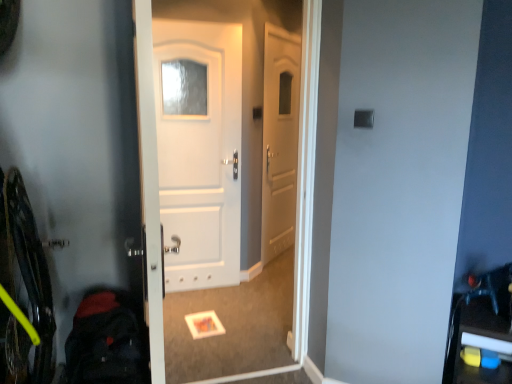
Question: From the image's perspective, is dark blue backpack at lower left over white matte door at center?

Choices:
 (A) yes
 (B) no

Answer: (B)

Question: Is dark blue backpack at lower left positioned behind white matte door at center?

Choices:
 (A) no
 (B) yes

Answer: (A)

Question: Considering the relative sizes of dark blue backpack at lower left and white matte door at center in the image provided, is dark blue backpack at lower left thinner than white matte door at center?

Choices:
 (A) yes
 (B) no

Answer: (B)

Question: Is dark blue backpack at lower left outside of white matte door at center?

Choices:
 (A) no
 (B) yes

Answer: (B)

Question: From a real-world perspective, is dark blue backpack at lower left located higher than white matte door at center?

Choices:
 (A) yes
 (B) no

Answer: (B)

Question: Is the surface of dark blue backpack at lower left in direct contact with white matte door at center?

Choices:
 (A) yes
 (B) no

Answer: (B)

Question: Considering the relative sizes of white matte door at center and dark blue backpack at lower left in the image provided, is white matte door at center smaller than dark blue backpack at lower left?

Choices:
 (A) no
 (B) yes

Answer: (A)

Question: Does white matte door at center have a greater width compared to dark blue backpack at lower left?

Choices:
 (A) yes
 (B) no

Answer: (B)

Question: From the image's perspective, does white matte door at center appear higher than dark blue backpack at lower left?

Choices:
 (A) yes
 (B) no

Answer: (A)

Question: Could you tell me if white matte door at center is facing dark blue backpack at lower left?

Choices:
 (A) no
 (B) yes

Answer: (A)

Question: From a real-world perspective, is white matte door at center positioned under dark blue backpack at lower left based on gravity?

Choices:
 (A) no
 (B) yes

Answer: (A)

Question: Is dark blue backpack at lower left inside white matte door at center?

Choices:
 (A) no
 (B) yes

Answer: (A)

Question: Relative to dark blue backpack at lower left, is white matte door at center in front or behind?

Choices:
 (A) behind
 (B) front

Answer: (A)